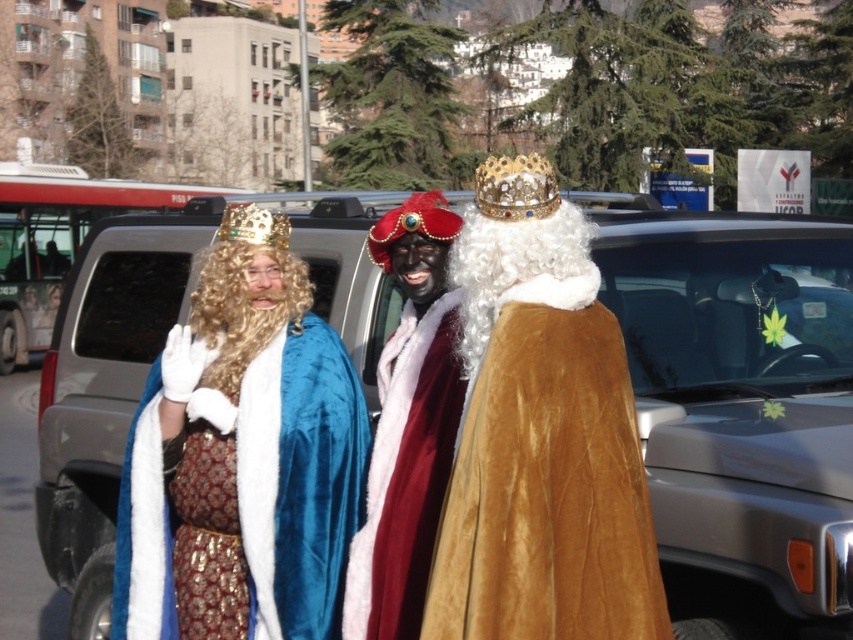
Question: Which point is farther from the camera taking this photo?

Choices:
 (A) (695, 592)
 (B) (550, 198)

Answer: (A)

Question: Which point is farther to the camera?

Choices:
 (A) brown velvet cape at center
 (B) metallic silver car at center

Answer: (B)

Question: Which point is closer to the camera?

Choices:
 (A) metallic silver car at center
 (B) gold metallic crown at center

Answer: (A)

Question: Can you confirm if velvet blue cape at center is positioned below velvet red cape at center?

Choices:
 (A) no
 (B) yes

Answer: (B)

Question: Does velvet blue cape at center have a greater width compared to gold jeweled crown at center?

Choices:
 (A) yes
 (B) no

Answer: (A)

Question: Is gold jeweled crown at center to the left of gold metallic crown at center from the viewer's perspective?

Choices:
 (A) no
 (B) yes

Answer: (A)